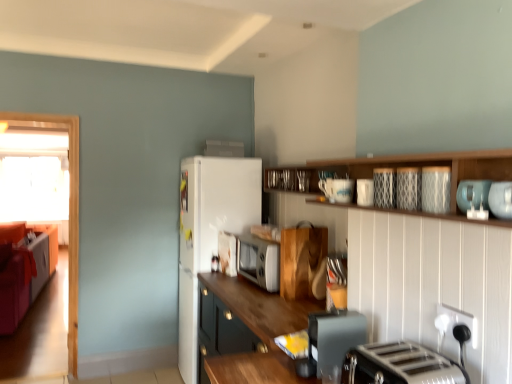
At what (x,y) coordinates should I click in order to perform the action: click on vacant area on top of wooden cabinet at center, which ranks as the second cabinetry in top-to-bottom order (from a real-world perspective). Please return your answer as a coordinate pair (x, y). Looking at the image, I should click on (270, 297).